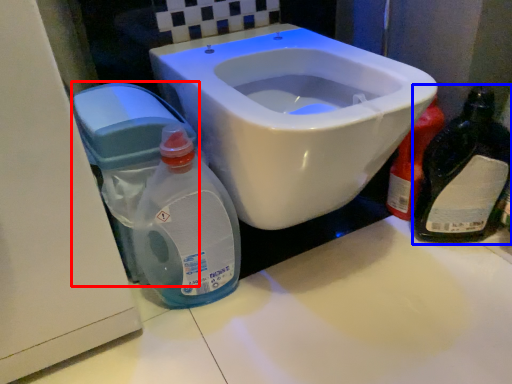
Question: Which point is closer to the camera, water tank (highlighted by a red box) or bottle (highlighted by a blue box)?

Choices:
 (A) water tank
 (B) bottle

Answer: (A)